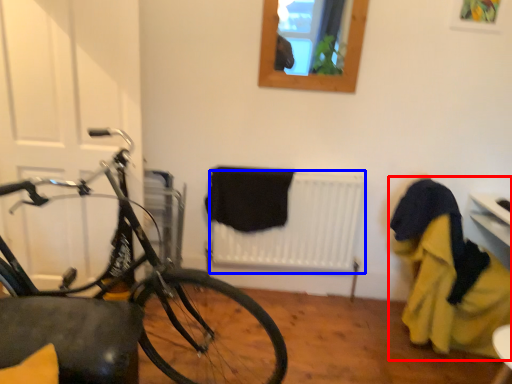
Question: Among these objects, which one is farthest to the camera, laundry (highlighted by a red box) or radiator (highlighted by a blue box)?

Choices:
 (A) laundry
 (B) radiator

Answer: (B)